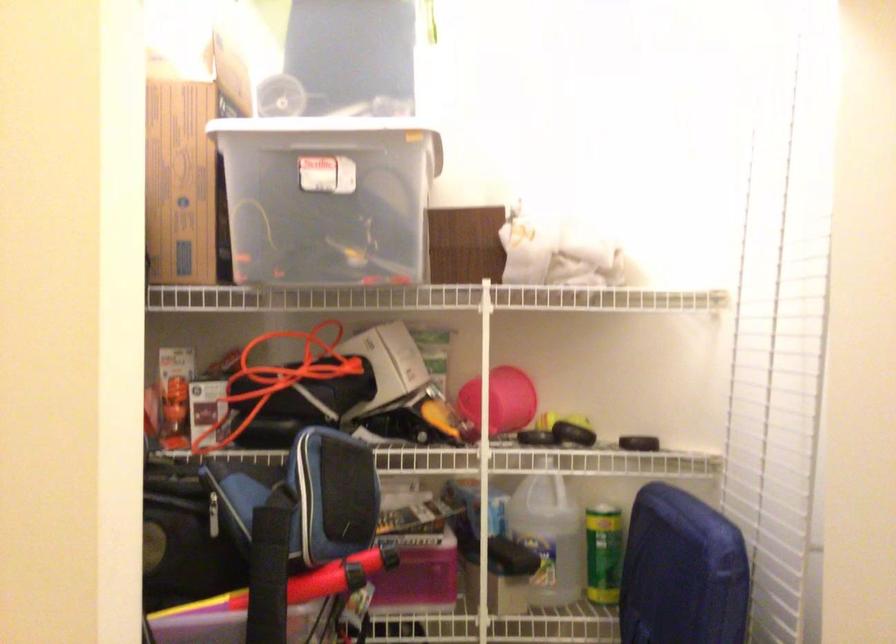
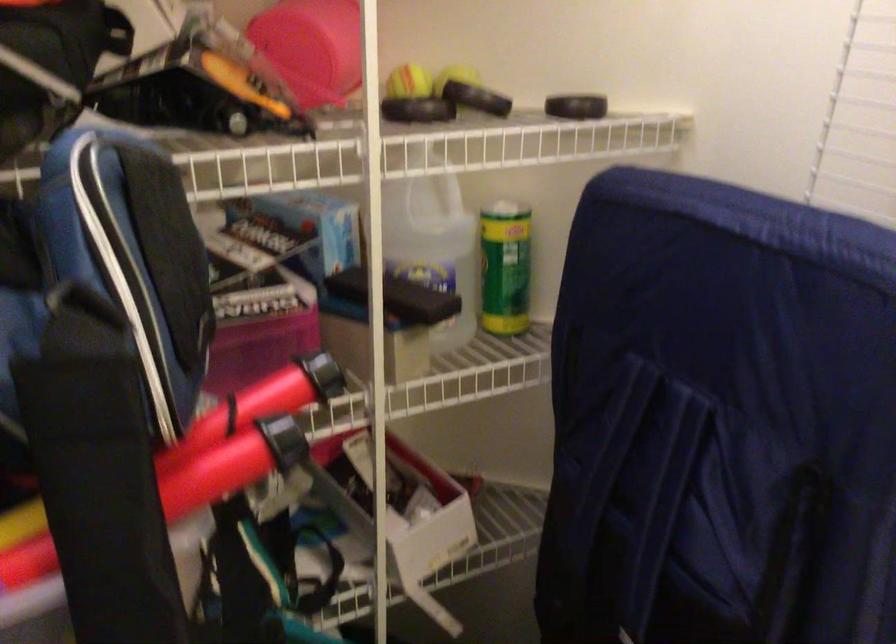
In the second image, find the point that corresponds to point 596,552 in the first image.

(504, 267)